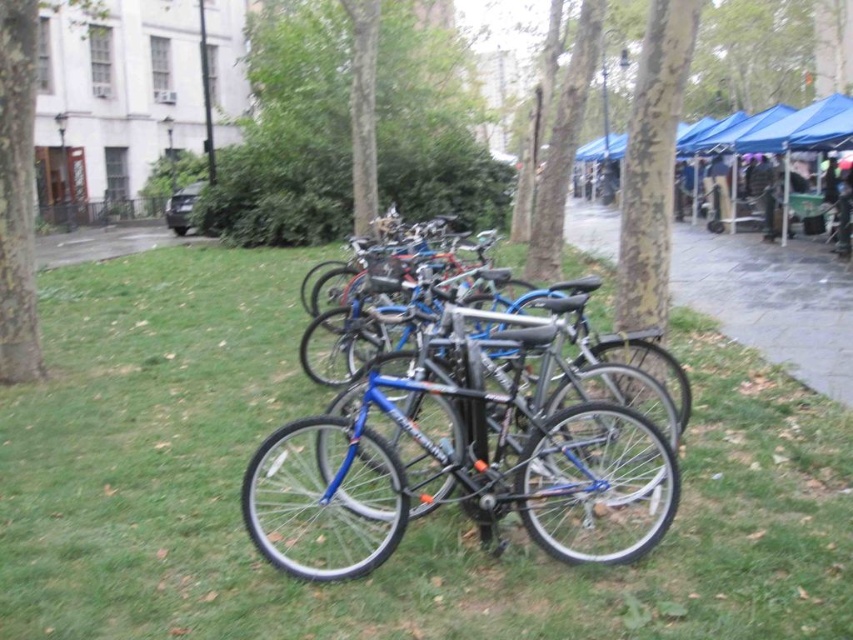
You are standing in the park and want to walk from the row of bicycles to the blue pop up tents. Which tree, the smooth bark tree at center or the smooth bark tree at upper center, would you pass first?

You would pass the smooth bark tree at center first because it is closer to the viewer than the smooth bark tree at upper center.

Consider the image. You are a delivery person who needs to load a package onto the blue metallic bicycle at center. The package is 1.8 meters tall. Will the package fit vertically without hitting the green leafy tree at center?

The blue metallic bicycle at center is shorter than the green leafy tree at center. Since the package is 1.8 meters tall, it might fit on the bicycle, but the height of the bicycle and the tree are not specified. However, since the bicycle is shorter than the tree, if the tree is taller than 1.8 meters, the package could fit. But without exact measurements, we can only say the bicycle is shorter than the tree, so the package might be manageable if the bicycle can support it.

You are standing in the park and want to find the green leafy tree at center. From your current position, which direction should you look to see it relative to the smooth bark tree at upper center?

The green leafy tree at center is located above the smooth bark tree at upper center, so you should look upwards from the smooth bark tree at upper center to see the green leafy tree at center.